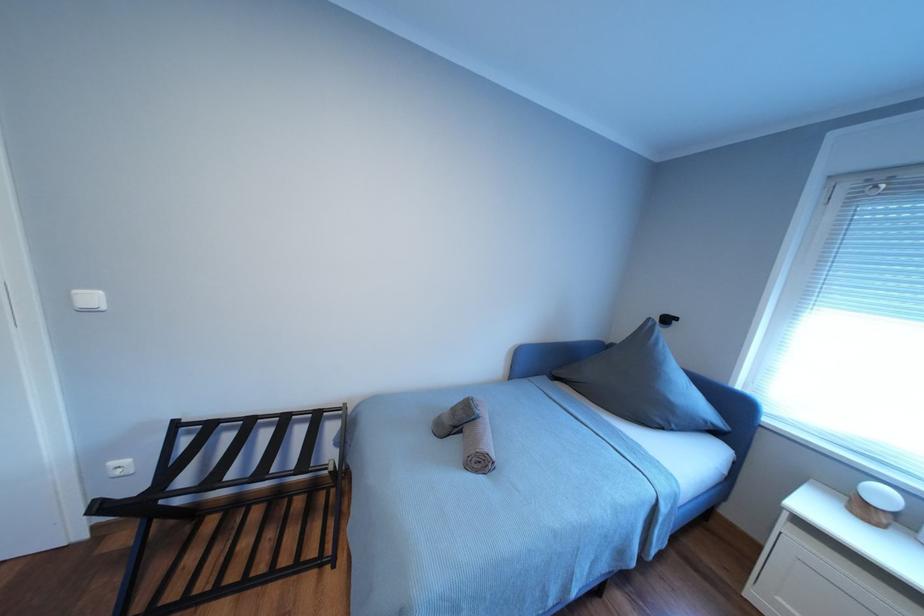
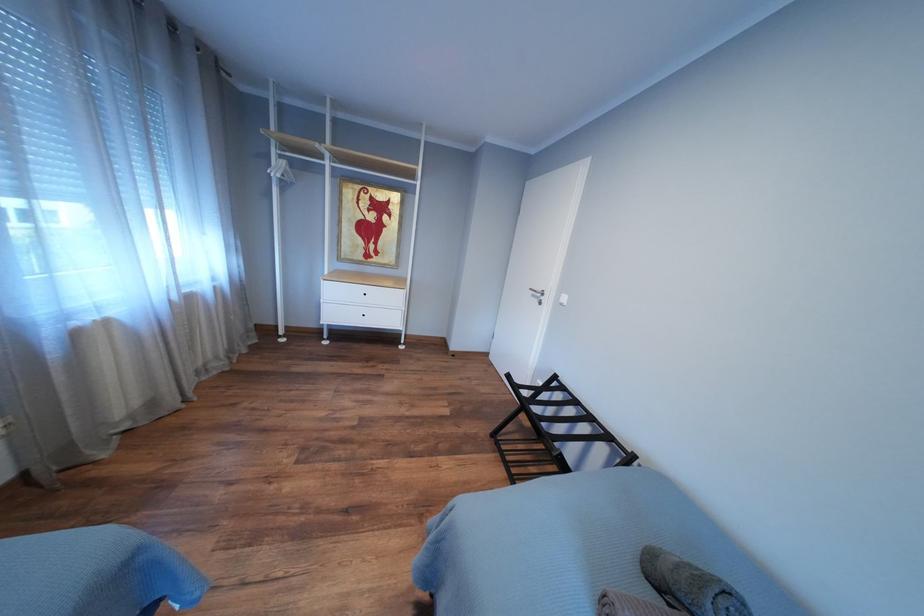
Question: How did the camera likely rotate?

Choices:
 (A) Left
 (B) Right
 (C) Up
 (D) Down

Answer: (A)